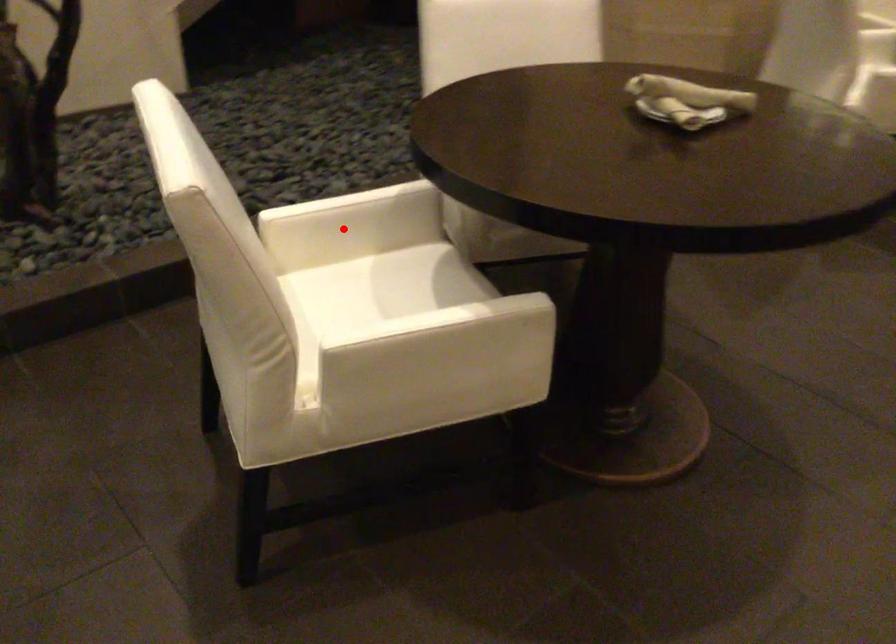
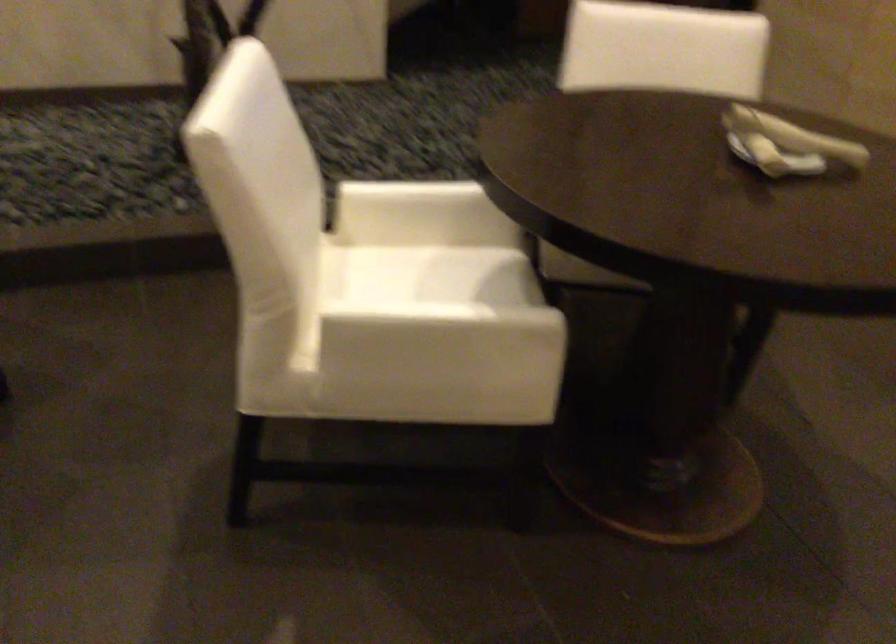
Locate, in the second image, the point that corresponds to the highlighted location in the first image.

(418, 214)